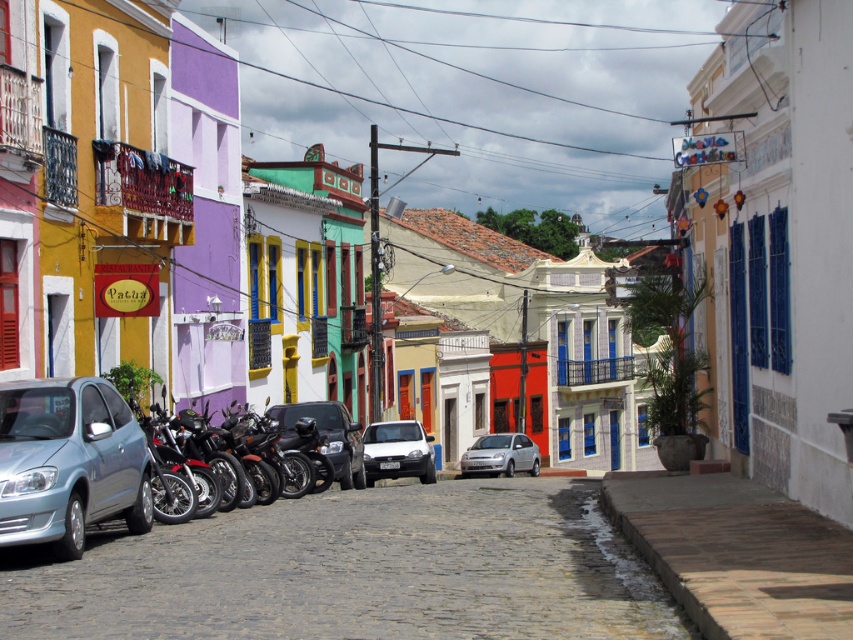
Measure the distance between point (x=30, y=428) and camera.

They are 34.66 feet apart.

Which of these two, light blue metallic car at lower left or shiny black car at center, stands taller?

shiny black car at center

Where is `light blue metallic car at lower left`? The height and width of the screenshot is (640, 853). light blue metallic car at lower left is located at coordinates (68, 461).

Is gray cobblestone alley at center thinner than shiny black car at center?

No, gray cobblestone alley at center is not thinner than shiny black car at center.

Who is more distant from viewer, (62,625) or (283,417)?

Positioned behind is point (283,417).

Image resolution: width=853 pixels, height=640 pixels. I want to click on gray cobblestone alley at center, so (x=354, y=570).

Who is positioned more to the right, shiny black car at center or silver metallic car at center?

From the viewer's perspective, silver metallic car at center appears more on the right side.

Between point (321, 428) and point (482, 467), which one is positioned behind?

Point (482, 467)

What do you see at coordinates (328, 435) in the screenshot?
I see `shiny black car at center` at bounding box center [328, 435].

This screenshot has width=853, height=640. Find the location of `shiny black car at center`. shiny black car at center is located at coordinates (328, 435).